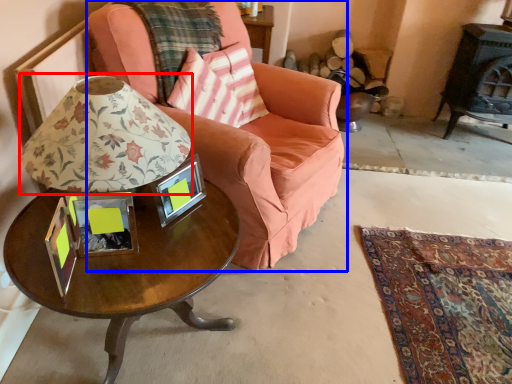
Question: Which object is closer to the camera taking this photo, table lamp (highlighted by a red box) or chair (highlighted by a blue box)?

Choices:
 (A) table lamp
 (B) chair

Answer: (A)